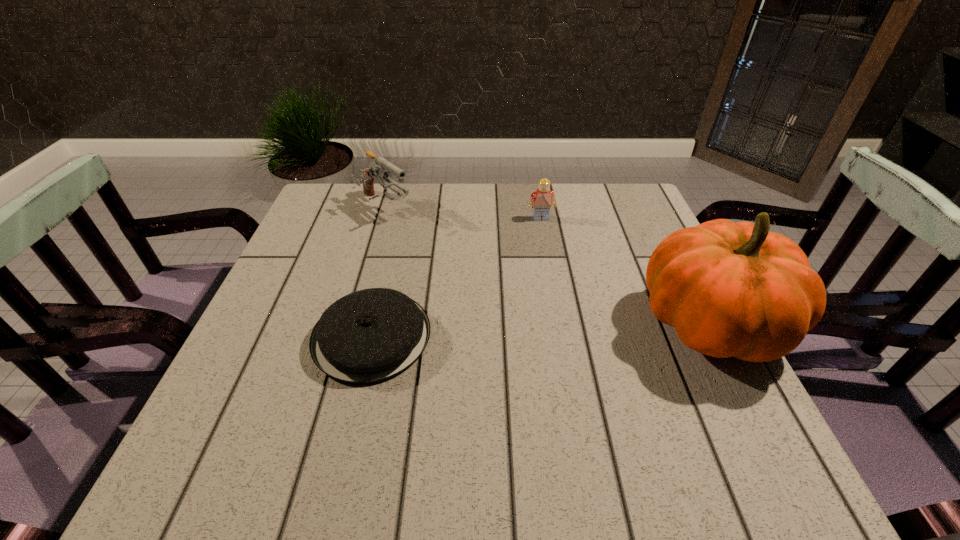
This screenshot has height=540, width=960. Find the location of `empty space that is in between the gun and the tallest object`. empty space that is in between the gun and the tallest object is located at coordinates (547, 267).

Identify the location of vacant point located between the third tallest object and the pumpkin. (625, 271).

Image resolution: width=960 pixels, height=540 pixels. In order to click on the closest object to the pumpkin in this screenshot , I will do `click(543, 198)`.

Locate which object is the third closest to the tallest object. Please provide its 2D coordinates. Your answer should be formatted as a tuple, i.e. [(x, y)], where the tuple contains the x and y coordinates of a point satisfying the conditions above.

[(377, 169)]

The image size is (960, 540). Identify the location of free space in the image that satisfies the following two spatial constraints: 1. on the back side of the pancake; 2. on the left side of the second object from right to left. (399, 218).

Where is `free spot that satisfies the following two spatial constraints: 1. on the front side of the second tallest object; 2. on the left side of the Lego`? free spot that satisfies the following two spatial constraints: 1. on the front side of the second tallest object; 2. on the left side of the Lego is located at coordinates (381, 218).

Locate an element on the screen. The height and width of the screenshot is (540, 960). vacant region that satisfies the following two spatial constraints: 1. on the back side of the shortest object; 2. on the left side of the pumpkin is located at coordinates (374, 325).

Find the location of a particular element. free space that satisfies the following two spatial constraints: 1. on the front side of the gun; 2. on the left side of the rightmost object is located at coordinates (350, 325).